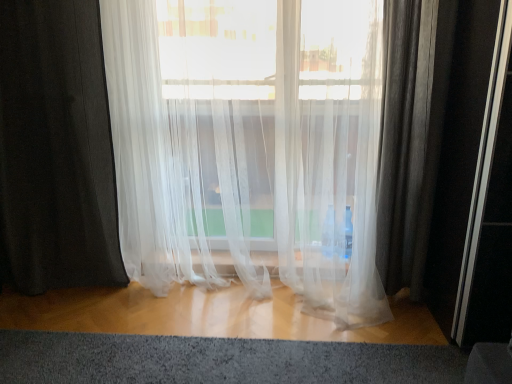
Where is `blank area beneath translucent white curtain at center, the 1th curtain when ordered from right to left (from a real-world perspective)`? blank area beneath translucent white curtain at center, the 1th curtain when ordered from right to left (from a real-world perspective) is located at coordinates (231, 298).